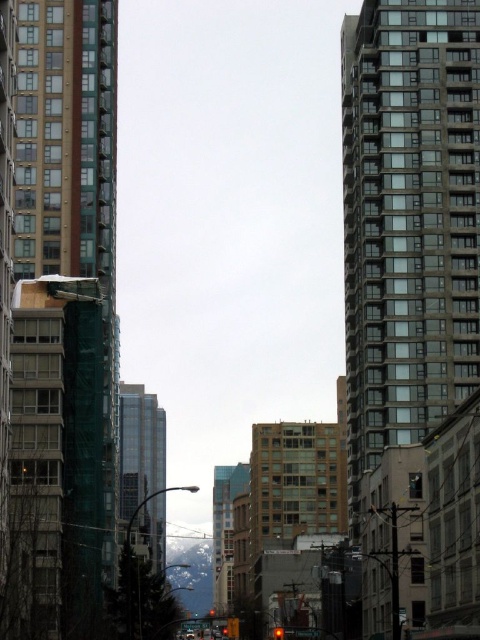
Describe the element at coordinates (60, 317) in the screenshot. I see `green glass building at left` at that location.

Does green glass building at left come in front of gray concrete building at center?

That is True.

Where is `green glass building at left`? The width and height of the screenshot is (480, 640). green glass building at left is located at coordinates (60, 317).

Where is `green glass building at left`? The height and width of the screenshot is (640, 480). green glass building at left is located at coordinates (60, 317).

Does gray concrete building at center appear on the left side of glassy reflective building at center?

Incorrect, gray concrete building at center is not on the left side of glassy reflective building at center.

Measure the distance between point (361,282) and camera.

Point (361,282) and camera are 137.81 meters apart from each other.

Who is more distant from viewer, (384,93) or (128,413)?

Point (128,413)

I want to click on gray concrete building at center, so click(x=408, y=220).

Which is below, green glass building at left or glassy reflective building at center?

glassy reflective building at center is below.

Is green glass building at left in front of glassy reflective building at center?

That is True.

Where is `green glass building at left`? green glass building at left is located at coordinates (60, 317).

You are a GUI agent. You are given a task and a screenshot of the screen. Output one action in this format:
    pyautogui.click(x=<x>, y=<y>)
    Task: Click on the green glass building at left
    
    Given the screenshot: What is the action you would take?
    pyautogui.click(x=60, y=317)